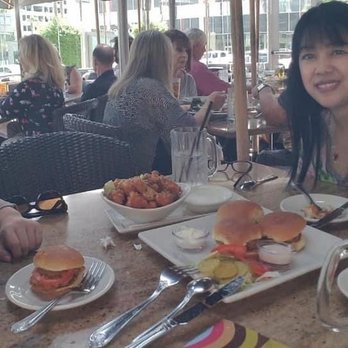
Find the location of a particular element. The image size is (348, 348). fork is located at coordinates (89, 281), (168, 277).